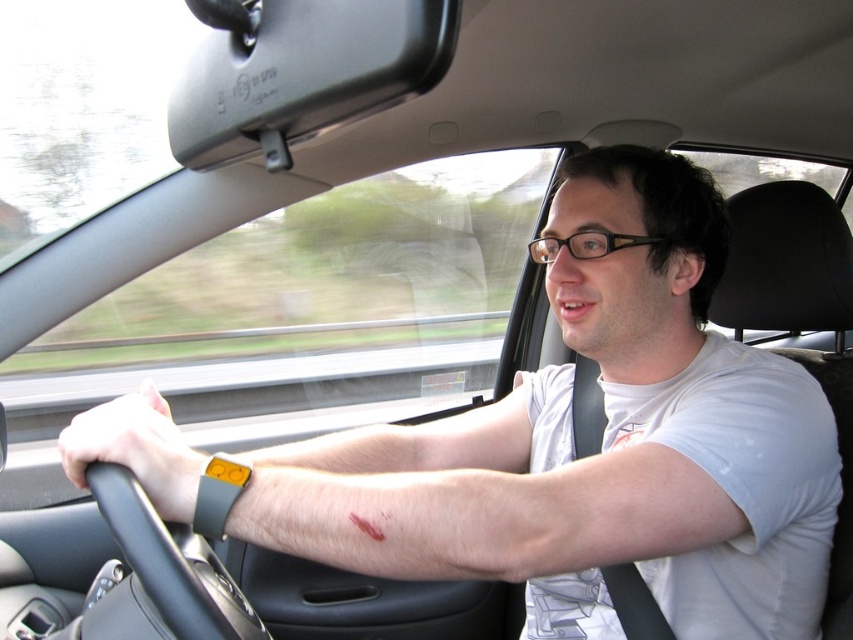
Question: Which of the following is the closest to the observer?

Choices:
 (A) (364, 529)
 (B) (334, 534)

Answer: (B)

Question: Where is light skin/soft hair at center located in relation to blood at arm lower right in the image?

Choices:
 (A) below
 (B) above

Answer: (B)

Question: Which of the following is the closest to the observer?

Choices:
 (A) (650, 490)
 (B) (105, 474)
 (C) (376, 538)

Answer: (C)

Question: Where is light skin/soft hair at center located in relation to blood at arm lower right in the image?

Choices:
 (A) below
 (B) above

Answer: (B)

Question: Among these points, which one is farthest from the camera?

Choices:
 (A) (497, 442)
 (B) (152, 600)

Answer: (A)

Question: Can you confirm if light skin/soft hair at center is positioned below blood at arm lower right?

Choices:
 (A) no
 (B) yes

Answer: (A)